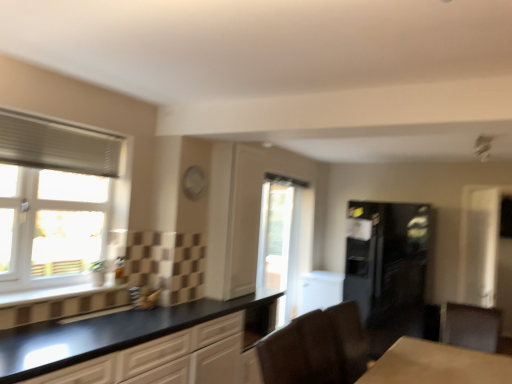
The height and width of the screenshot is (384, 512). I want to click on free space below white pleated blind at upper left (from a real-world perspective), so click(x=44, y=291).